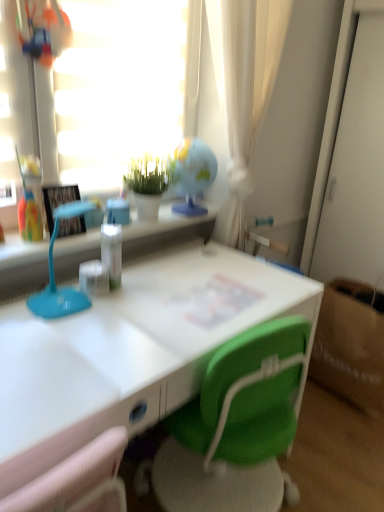
Question: Is green matte plant at upper center wider or thinner than clear plastic bottle at center?

Choices:
 (A) thin
 (B) wide

Answer: (B)

Question: From a real-world perspective, is green matte plant at upper center physically located above or below clear plastic bottle at center?

Choices:
 (A) above
 (B) below

Answer: (A)

Question: Which object is the farthest from the green matte plant at upper center?

Choices:
 (A) clear plastic bottle at center
 (B) transparent glass globe at upper center
 (C) matte black picture frame at left
 (D) white glossy desk at center
 (E) brown paper bag at lower right

Answer: (E)

Question: Estimate the real-world distances between objects in this image. Which object is closer to the white glossy desk at center?

Choices:
 (A) green matte plant at upper center
 (B) transparent glass globe at upper center
 (C) brown paper bag at lower right
 (D) clear plastic bottle at center
 (E) matte black picture frame at left

Answer: (D)